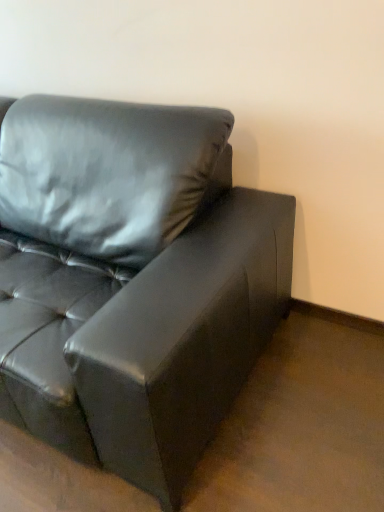
This screenshot has height=512, width=384. Describe the element at coordinates (132, 281) in the screenshot. I see `matte black couch at upper left` at that location.

In order to face matte black couch at upper left, should I rotate leftwards or rightwards?

A 22.166 degree turn to the left will do.

This screenshot has width=384, height=512. I want to click on matte black couch at upper left, so click(132, 281).

Identify the location of matte black couch at upper left. This screenshot has height=512, width=384. (132, 281).